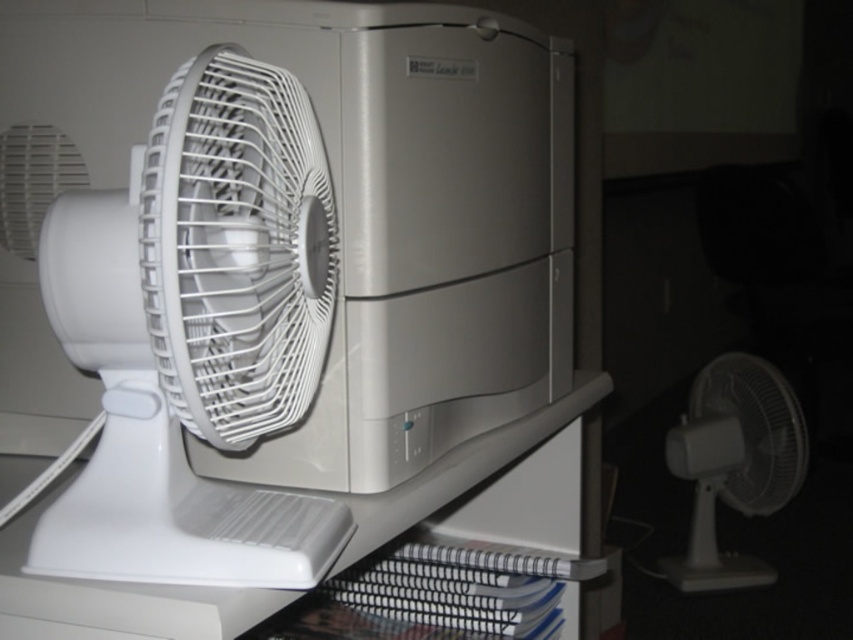
Does white plastic fan at left have a greater height compared to white plastic fan at lower right?

No.

Between white plastic fan at left and white plastic fan at lower right, which one is positioned higher?

white plastic fan at left

Between point (175, 324) and point (708, 400), which one is positioned in front?

Point (175, 324) is in front.

You are a GUI agent. You are given a task and a screenshot of the screen. Output one action in this format:
    pyautogui.click(x=<x>, y=<y>)
    Task: Click on the white plastic fan at left
    
    Given the screenshot: What is the action you would take?
    pos(198,333)